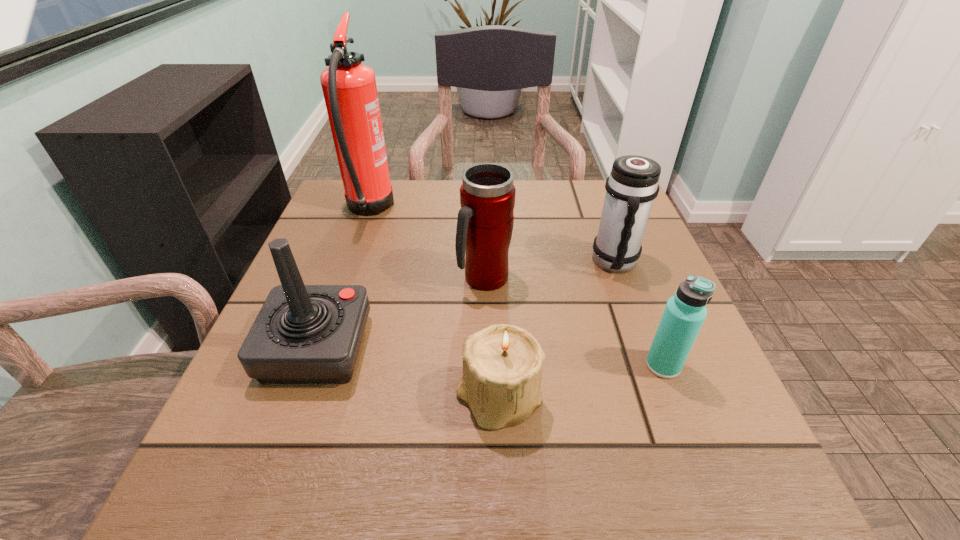
Identify which object is the nearest to the shortest object. Please provide its 2D coordinates. Your answer should be formatted as a tuple, i.e. [(x, y)], where the tuple contains the x and y coordinates of a point satisfying the conditions above.

[(304, 334)]

Locate an element on the screen. This screenshot has width=960, height=540. the closest thermos bottle to the joystick is located at coordinates coord(485,221).

What are the coordinates of `thermos bottle that stands as the third closest to the fire extinguisher` in the screenshot? It's located at 685,312.

Image resolution: width=960 pixels, height=540 pixels. What are the coordinates of `free space that satisfies the following two spatial constraints: 1. at the nozzle of the nearest thermos bottle; 2. on the left side of the farthest object` in the screenshot? It's located at (314, 365).

Where is `free spot that satisfies the following two spatial constraints: 1. on the side with the handle of the shortest object; 2. on the right side of the leftmost thermos bottle`? The image size is (960, 540). free spot that satisfies the following two spatial constraints: 1. on the side with the handle of the shortest object; 2. on the right side of the leftmost thermos bottle is located at coordinates (486, 398).

Identify the location of free spot that satisfies the following two spatial constraints: 1. at the nozzle of the farthest object; 2. on the left side of the nearest thermos bottle. (314, 365).

Locate an element on the screen. vacant space that satisfies the following two spatial constraints: 1. on the side with the handle of the shortest object; 2. on the left side of the leftmost thermos bottle is located at coordinates (486, 398).

Where is `vacant region that satisfies the following two spatial constraints: 1. on the side with the handle of the leftmost thermos bottle; 2. on the front-facing side of the joystick`? This screenshot has width=960, height=540. vacant region that satisfies the following two spatial constraints: 1. on the side with the handle of the leftmost thermos bottle; 2. on the front-facing side of the joystick is located at coordinates (486, 348).